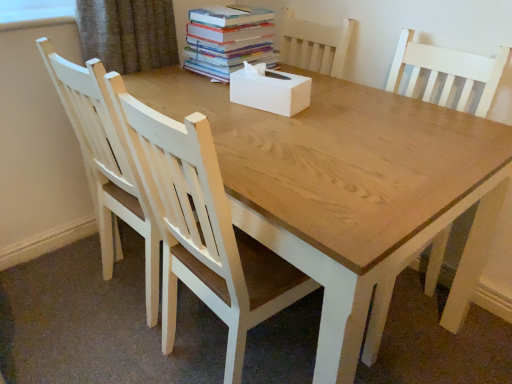
Question: Is white wood chair at left, which ranks as the second chair in right-to-left order, facing towards hardcover books at upper center?

Choices:
 (A) no
 (B) yes

Answer: (B)

Question: Does white wood chair at left, which is the 1th chair from left to right, have a lesser height compared to hardcover books at upper center?

Choices:
 (A) yes
 (B) no

Answer: (B)

Question: Is white wood chair at left, which ranks as the second chair in right-to-left order, facing away from hardcover books at upper center?

Choices:
 (A) yes
 (B) no

Answer: (B)

Question: From a real-world perspective, does white wood chair at left, which is the 1th chair from left to right, stand above hardcover books at upper center?

Choices:
 (A) no
 (B) yes

Answer: (A)

Question: Can you confirm if white wood chair at left, which ranks as the second chair in right-to-left order, is thinner than hardcover books at upper center?

Choices:
 (A) no
 (B) yes

Answer: (A)

Question: Is point (240, 329) positioned closer to the camera than point (297, 107)?

Choices:
 (A) farther
 (B) closer

Answer: (B)

Question: From their relative heights in the image, would you say white wood chair at center, which is the first chair from right to left, is taller or shorter than white matte tissue box at center?

Choices:
 (A) short
 (B) tall

Answer: (B)

Question: Based on their sizes in the image, would you say white wood chair at center, which is the first chair from right to left, is bigger or smaller than white matte tissue box at center?

Choices:
 (A) small
 (B) big

Answer: (B)

Question: Looking at their shapes, would you say white wood chair at center, the second chair positioned from the left, is wider or thinner than white matte tissue box at center?

Choices:
 (A) wide
 (B) thin

Answer: (A)

Question: Looking at the image, does white wood chair at center, the second chair positioned from the left, seem bigger or smaller compared to white wood chair at left, which is the 1th chair from left to right?

Choices:
 (A) big
 (B) small

Answer: (A)

Question: Is white wood chair at center, which is the first chair from right to left, situated inside white wood chair at left, which ranks as the second chair in right-to-left order, or outside?

Choices:
 (A) outside
 (B) inside

Answer: (A)

Question: Does point (133, 112) appear closer or farther from the camera than point (109, 114)?

Choices:
 (A) closer
 (B) farther

Answer: (A)

Question: Considering the positions of white wood chair at center, which is the first chair from right to left, and white wood chair at left, which ranks as the second chair in right-to-left order, in the image, is white wood chair at center, which is the first chair from right to left, taller or shorter than white wood chair at left, which ranks as the second chair in right-to-left order,?

Choices:
 (A) tall
 (B) short

Answer: (B)

Question: In terms of width, does white wood chair at left, which ranks as the second chair in right-to-left order, look wider or thinner when compared to white matte tissue box at center?

Choices:
 (A) thin
 (B) wide

Answer: (B)

Question: Considering the positions of point (103, 215) and point (291, 82), is point (103, 215) closer or farther from the camera than point (291, 82)?

Choices:
 (A) closer
 (B) farther

Answer: (B)